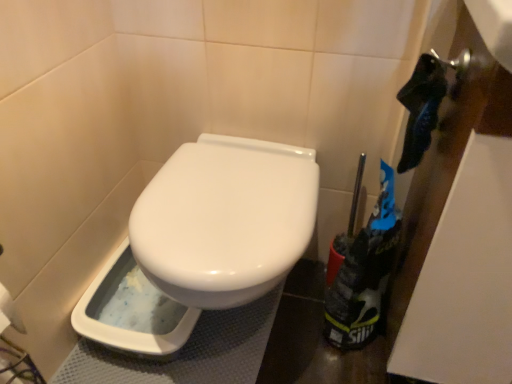
Question: Visually, is black fabric bag at right positioned to the left or to the right of white plastic bidet at lower left?

Choices:
 (A) right
 (B) left

Answer: (A)

Question: From their relative heights in the image, would you say black fabric bag at right is taller or shorter than white plastic bidet at lower left?

Choices:
 (A) tall
 (B) short

Answer: (A)

Question: Is black fabric bag at right inside the boundaries of white plastic bidet at lower left, or outside?

Choices:
 (A) inside
 (B) outside

Answer: (B)

Question: Considering their positions, is white plastic bidet at lower left located in front of or behind black fabric bag at right?

Choices:
 (A) front
 (B) behind

Answer: (B)

Question: Would you say white plastic bidet at lower left is inside or outside black fabric bag at right?

Choices:
 (A) inside
 (B) outside

Answer: (B)

Question: Visually, is white plastic bidet at lower left positioned to the left or to the right of black fabric bag at right?

Choices:
 (A) left
 (B) right

Answer: (A)

Question: From a real-world perspective, is white plastic bidet at lower left physically located above or below black fabric bag at right?

Choices:
 (A) below
 (B) above

Answer: (A)